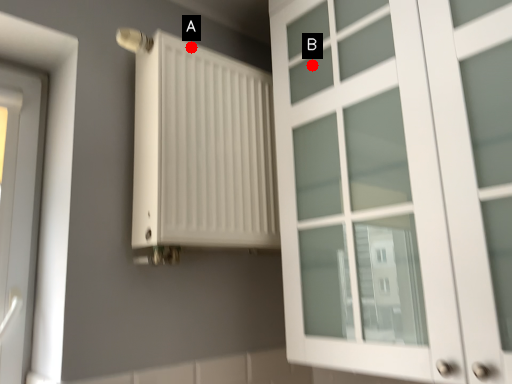
Question: Two points are circled on the image, labeled by A and B beside each circle. Which point is closer to the camera?

Choices:
 (A) A is closer
 (B) B is closer

Answer: (A)